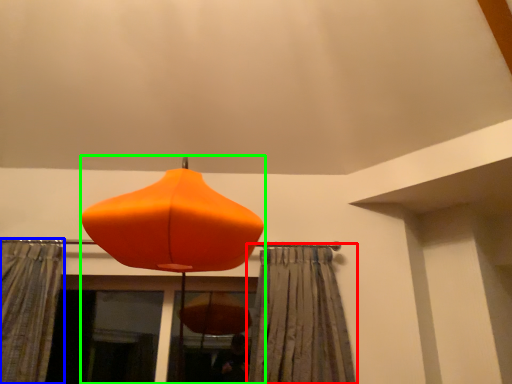
Question: Considering the real-world distances, which object is closest to curtain (highlighted by a red box)? curtain (highlighted by a blue box) or lamp (highlighted by a green box).

Choices:
 (A) curtain
 (B) lamp

Answer: (B)